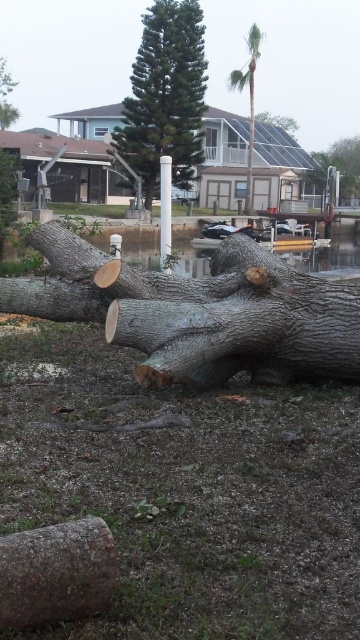
Question: Considering the relative positions of smooth gray log at center and white plastic pole at center in the image provided, where is smooth gray log at center located with respect to white plastic pole at center?

Choices:
 (A) below
 (B) above

Answer: (B)

Question: From the image, what is the correct spatial relationship of brown rough log at lower left in relation to green rough bark tree at center?

Choices:
 (A) below
 (B) above

Answer: (A)

Question: Which point is closer to the camera?

Choices:
 (A) gray rough tree trunk at center
 (B) green textured solar panel at upper center
 (C) brown rough log at lower left

Answer: (C)

Question: Which of the following is the closest to the observer?

Choices:
 (A) (284, 122)
 (B) (240, 83)

Answer: (B)

Question: Is smooth gray log at center to the right of green rough bark tree at center from the viewer's perspective?

Choices:
 (A) yes
 (B) no

Answer: (A)

Question: Which of the following is the closest to the observer?

Choices:
 (A) smooth gray log at center
 (B) green rough bark tree at center

Answer: (A)